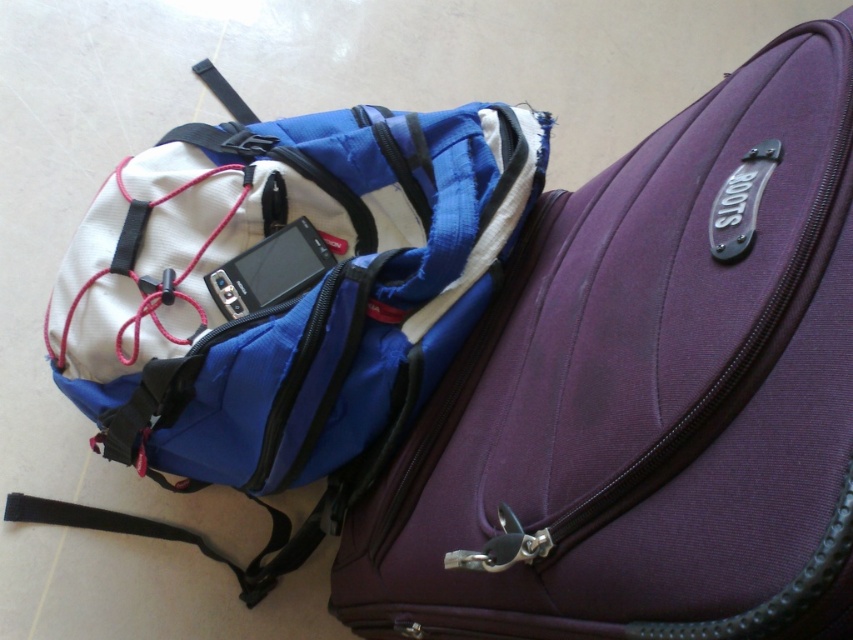
From the picture: Which is below, purple fabric suitcase at center or blue fabric backpack at upper left?

purple fabric suitcase at center

Is purple fabric suitcase at center to the right of blue fabric backpack at upper left from the viewer's perspective?

Indeed, purple fabric suitcase at center is positioned on the right side of blue fabric backpack at upper left.

Image resolution: width=853 pixels, height=640 pixels. What do you see at coordinates (647, 396) in the screenshot?
I see `purple fabric suitcase at center` at bounding box center [647, 396].

This screenshot has height=640, width=853. What are the coordinates of `purple fabric suitcase at center` in the screenshot? It's located at (647, 396).

Does purple fabric suitcase at center lie behind satin black smartphone at center?

No, it is not.

The height and width of the screenshot is (640, 853). What are the coordinates of `purple fabric suitcase at center` in the screenshot? It's located at (647, 396).

At what (x,y) coordinates should I click in order to perform the action: click on purple fabric suitcase at center. Please return your answer as a coordinate pair (x, y). This screenshot has width=853, height=640. Looking at the image, I should click on (647, 396).

Between blue fabric backpack at upper left and satin black smartphone at center, which one is positioned lower?

satin black smartphone at center is lower down.

Is point (384, 116) closer to camera compared to point (244, 269)?

No, (384, 116) is behind (244, 269).

You are a GUI agent. You are given a task and a screenshot of the screen. Output one action in this format:
    pyautogui.click(x=<x>, y=<y>)
    Task: Click on the blue fabric backpack at upper left
    The height and width of the screenshot is (640, 853).
    Given the screenshot: What is the action you would take?
    pyautogui.click(x=281, y=301)